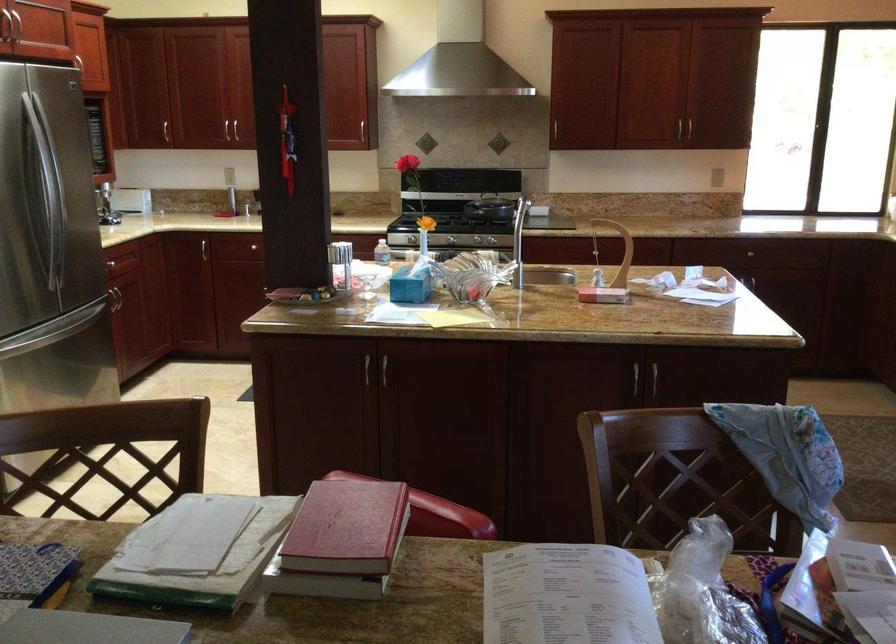
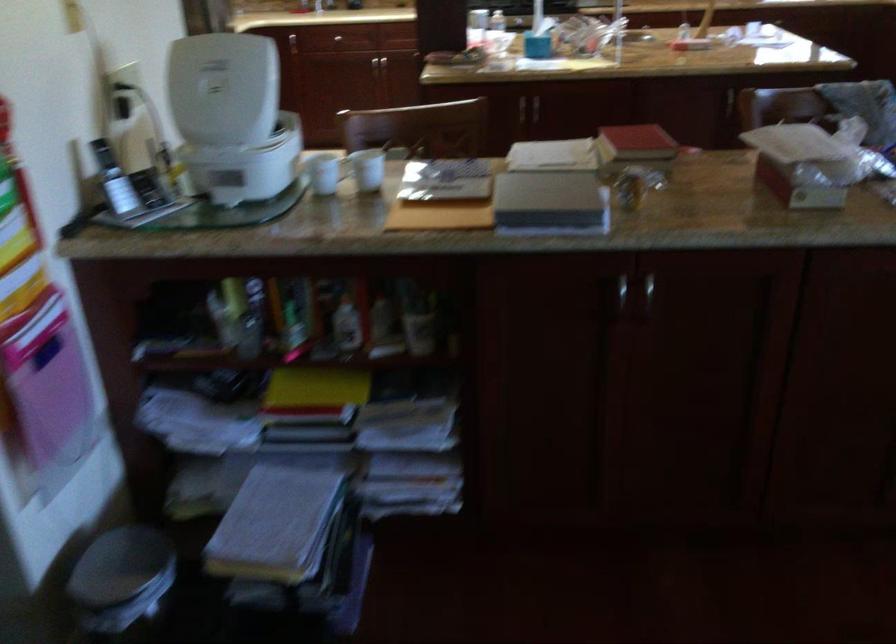
The images are taken continuously from a first-person perspective. In which direction are you moving?

The movement direction of the cameraman is left, backward.